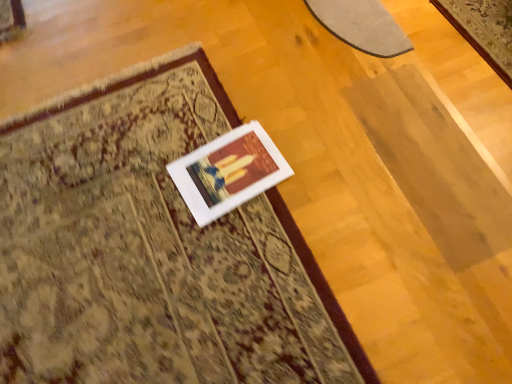
Identify the location of vacant area on the back side of white matte picture frame at center. (198, 112).